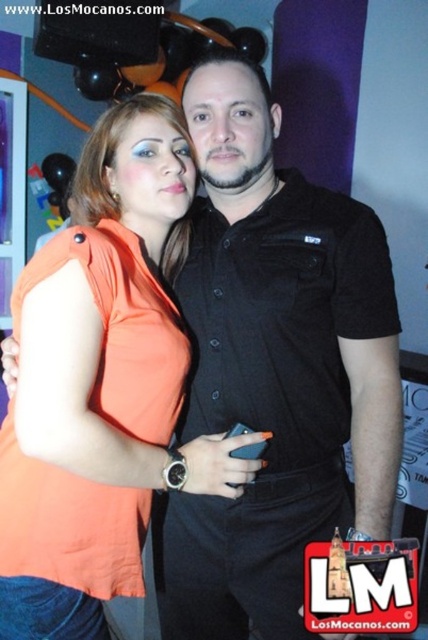
Which is above, black matte shirt at center or orange fabric dress at center?

black matte shirt at center is above.

Which is in front, point (246, 336) or point (35, 561)?

Point (35, 561) is more forward.

You are a GUI agent. You are given a task and a screenshot of the screen. Output one action in this format:
    pyautogui.click(x=<x>, y=<y>)
    Task: Click on the black matte shirt at center
    This screenshot has height=640, width=428.
    Given the screenshot: What is the action you would take?
    pyautogui.click(x=275, y=369)

Locate an element on the screen. black matte shirt at center is located at coordinates (275, 369).